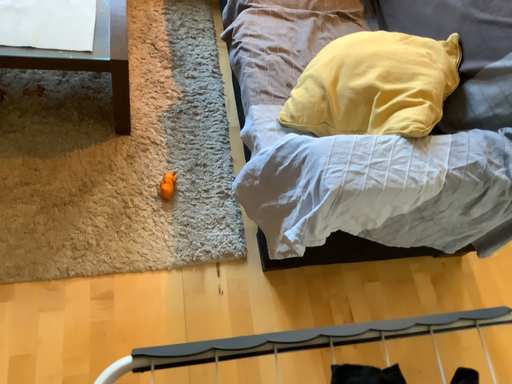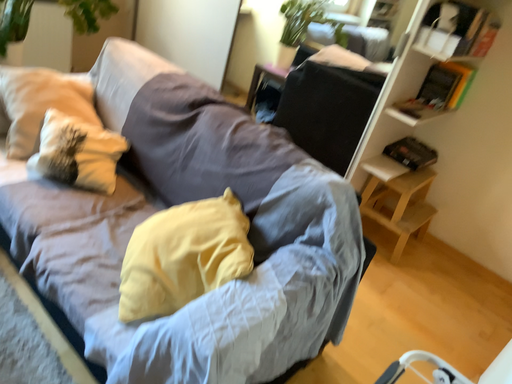
Question: Which way did the camera rotate in the video?

Choices:
 (A) rotated downward
 (B) rotated upward

Answer: (B)